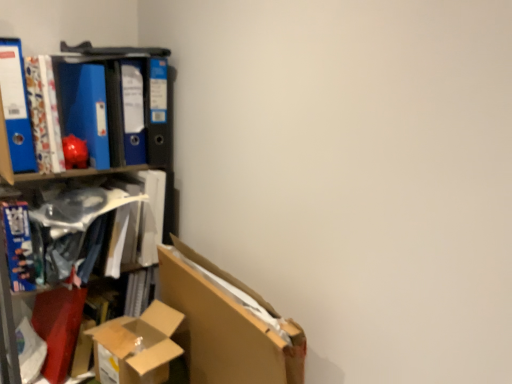
What is the approximate width of blue glossy book at left, acting as the second book starting from the right?

10.69 inches.

This screenshot has width=512, height=384. Find the location of `blue glossy book at left, acting as the second book starting from the right`. blue glossy book at left, acting as the second book starting from the right is located at coordinates (19, 246).

The image size is (512, 384). What do you see at coordinates (137, 346) in the screenshot?
I see `cardboard box at lower left` at bounding box center [137, 346].

This screenshot has width=512, height=384. What do you see at coordinates (95, 219) in the screenshot?
I see `matte plastic book at left, the first book when ordered from right to left` at bounding box center [95, 219].

Find the location of a particular element. The image size is (512, 384). blue glossy book at left, which ranks as the first book in left-to-right order is located at coordinates (19, 246).

Would you say blue matte folder at upper left, the 3th paperback book positioned from the left, is to the left or to the right of blue glossy book at left, acting as the second book starting from the right, in the picture?

Clearly, blue matte folder at upper left, the 3th paperback book positioned from the left, is on the right of blue glossy book at left, acting as the second book starting from the right, in the image.

From the picture: Is blue matte folder at upper left, the 3th paperback book positioned from the left, closer to camera compared to blue glossy book at left, which ranks as the first book in left-to-right order?

That is False.

Does point (140, 99) appear closer or farther from the camera than point (17, 291)?

Point (140, 99) is farther from the camera than point (17, 291).

How distant is blue matte folder at upper left, the 3th paperback book positioned from the left, from blue glossy book at left, which ranks as the first book in left-to-right order?

blue matte folder at upper left, the 3th paperback book positioned from the left, and blue glossy book at left, which ranks as the first book in left-to-right order, are 17.09 inches apart.

Who is shorter, blue matte folder at upper left, marked as the 2th paperback book in a left-to-right arrangement, or cardboard box at lower left?

cardboard box at lower left.

Consider the image. How far apart are blue matte folder at upper left, marked as the 2th paperback book in a left-to-right arrangement, and cardboard box at lower left?

blue matte folder at upper left, marked as the 2th paperback book in a left-to-right arrangement, is 24.28 inches from cardboard box at lower left.

Is blue matte folder at upper left, positioned as the second paperback book in right-to-left order, facing away from cardboard box at lower left?

blue matte folder at upper left, positioned as the second paperback book in right-to-left order, is not turned away from cardboard box at lower left.

Considering the points (56, 63) and (155, 311), which point is behind, point (56, 63) or point (155, 311)?

The point (155, 311) is behind.

From the picture: Who is smaller, blue glossy book at left, acting as the second book starting from the right, or cardboard box at lower left?

Smaller between the two is blue glossy book at left, acting as the second book starting from the right.

Is blue glossy book at left, which ranks as the first book in left-to-right order, taller or shorter than cardboard box at lower left?

Considering their sizes, blue glossy book at left, which ranks as the first book in left-to-right order, has more height than cardboard box at lower left.

How different are the orientations of blue glossy book at left, which ranks as the first book in left-to-right order, and cardboard box at lower left in degrees?

170 degrees separate the facing orientations of blue glossy book at left, which ranks as the first book in left-to-right order, and cardboard box at lower left.

From the image's perspective, relative to cardboard box at lower left, is blue glossy book at left, which ranks as the first book in left-to-right order, above or below?

blue glossy book at left, which ranks as the first book in left-to-right order, is above cardboard box at lower left.

Would you say cardboard box at lower left is a long distance from blue matte folder at upper left, the 3th paperback book positioned from the left?

That's not correct — cardboard box at lower left is a little close to blue matte folder at upper left, the 3th paperback book positioned from the left.

Considering the positions of objects cardboard box at lower left and blue matte folder at upper left, which is the first paperback book in right-to-left order, in the image provided, who is more to the left, cardboard box at lower left or blue matte folder at upper left, which is the first paperback book in right-to-left order,?

Positioned to the left is blue matte folder at upper left, which is the first paperback book in right-to-left order.

Is cardboard box at lower left facing away from blue matte folder at upper left, which is the first paperback book in right-to-left order?

No, cardboard box at lower left is not facing the opposite direction of blue matte folder at upper left, which is the first paperback book in right-to-left order.

From the picture: Is cardboard box at lower left not inside blue matte folder at upper left, the 3th paperback book positioned from the left?

cardboard box at lower left lies outside blue matte folder at upper left, the 3th paperback book positioned from the left,'s area.

Find the location of a particular element. This screenshot has width=512, height=384. box that is in front of the blue matte folder at upper left, marked as the 2th paperback book in a left-to-right arrangement is located at coordinates (137, 346).

From their relative heights in the image, would you say cardboard box at lower left is taller or shorter than blue matte folder at upper left, marked as the 2th paperback book in a left-to-right arrangement?

In the image, cardboard box at lower left appears to be shorter than blue matte folder at upper left, marked as the 2th paperback book in a left-to-right arrangement.

Does cardboard box at lower left contain blue matte folder at upper left, positioned as the second paperback book in right-to-left order?

No, blue matte folder at upper left, positioned as the second paperback book in right-to-left order, is not inside cardboard box at lower left.

Who is bigger, blue matte folder at left, which appears as the third paperback book when viewed from the right, or blue matte folder at upper left, the 3th paperback book positioned from the left?

Bigger between the two is blue matte folder at upper left, the 3th paperback book positioned from the left.

Is blue matte folder at left, arranged as the 1th paperback book when viewed from the left, at the right side of blue matte folder at upper left, the 3th paperback book positioned from the left?

No.

Based on the photo, which point is more forward, [7,46] or [135,142]?

The point [7,46] is in front.

Is blue matte folder at left, which appears as the third paperback book when viewed from the right, oriented away from blue matte folder at upper left, the 3th paperback book positioned from the left?

blue matte folder at left, which appears as the third paperback book when viewed from the right, is not turned away from blue matte folder at upper left, the 3th paperback book positioned from the left.

In terms of width, does blue glossy book at left, which ranks as the first book in left-to-right order, look wider or thinner when compared to blue matte folder at upper left, marked as the 2th paperback book in a left-to-right arrangement?

Clearly, blue glossy book at left, which ranks as the first book in left-to-right order, has more width compared to blue matte folder at upper left, marked as the 2th paperback book in a left-to-right arrangement.

From the image's perspective, is blue glossy book at left, which ranks as the first book in left-to-right order, below blue matte folder at upper left, positioned as the second paperback book in right-to-left order?

Correct, blue glossy book at left, which ranks as the first book in left-to-right order, appears lower than blue matte folder at upper left, positioned as the second paperback book in right-to-left order, in the image.

Is blue glossy book at left, which ranks as the first book in left-to-right order, not close to blue matte folder at upper left, marked as the 2th paperback book in a left-to-right arrangement?

blue glossy book at left, which ranks as the first book in left-to-right order, is actually quite close to blue matte folder at upper left, marked as the 2th paperback book in a left-to-right arrangement.

From a real-world perspective, relative to blue matte folder at upper left, marked as the 2th paperback book in a left-to-right arrangement, is blue glossy book at left, which ranks as the first book in left-to-right order, vertically above or below?

blue glossy book at left, which ranks as the first book in left-to-right order, is situated lower than blue matte folder at upper left, marked as the 2th paperback book in a left-to-right arrangement, in the real world.

Locate an element on the screen. the 3rd paperback book above when counting from the blue glossy book at left, which ranks as the first book in left-to-right order (from the image's perspective) is located at coordinates (133, 112).

Locate an element on the screen. Image resolution: width=512 pixels, height=384 pixels. box located below the blue matte folder at upper left, marked as the 2th paperback book in a left-to-right arrangement (from the image's perspective) is located at coordinates (137, 346).

Looking at the image, which one is located closer to blue matte folder at upper left, the 3th paperback book positioned from the left, cardboard box at lower left or blue glossy book at left, acting as the second book starting from the right?

The object closer to blue matte folder at upper left, the 3th paperback book positioned from the left, is blue glossy book at left, acting as the second book starting from the right.

Estimate the real-world distances between objects in this image. Which object is closer to cardboard box at lower left, blue matte folder at upper left, the 3th paperback book positioned from the left, or blue matte folder at upper left, positioned as the second paperback book in right-to-left order?

blue matte folder at upper left, the 3th paperback book positioned from the left.

When comparing their distances from blue glossy book at left, which ranks as the first book in left-to-right order, does blue matte folder at upper left, marked as the 2th paperback book in a left-to-right arrangement, or blue matte folder at left, which appears as the third paperback book when viewed from the right, seem further?

blue matte folder at upper left, marked as the 2th paperback book in a left-to-right arrangement, is further to blue glossy book at left, which ranks as the first book in left-to-right order.

Estimate the real-world distances between objects in this image. Which object is closer to matte plastic book at left, which is the 2th book from left to right, blue matte folder at upper left, which is the first paperback book in right-to-left order, or blue glossy book at left, which ranks as the first book in left-to-right order?

Among the two, blue glossy book at left, which ranks as the first book in left-to-right order, is located nearer to matte plastic book at left, which is the 2th book from left to right.

From the image, which object appears to be nearer to blue matte folder at left, which appears as the third paperback book when viewed from the right, cardboard box at lower left or blue glossy book at left, which ranks as the first book in left-to-right order?

Based on the image, blue glossy book at left, which ranks as the first book in left-to-right order, appears to be nearer to blue matte folder at left, which appears as the third paperback book when viewed from the right.

Based on their spatial positions, is blue glossy book at left, acting as the second book starting from the right, or blue matte folder at upper left, marked as the 2th paperback book in a left-to-right arrangement, closer to matte plastic book at left, which is the 2th book from left to right?

blue glossy book at left, acting as the second book starting from the right.

Which object lies further to the anchor point blue glossy book at left, which ranks as the first book in left-to-right order, blue matte folder at upper left, the 3th paperback book positioned from the left, or blue matte folder at left, arranged as the 1th paperback book when viewed from the left?

Among the two, blue matte folder at upper left, the 3th paperback book positioned from the left, is located further to blue glossy book at left, which ranks as the first book in left-to-right order.

Estimate the real-world distances between objects in this image. Which object is closer to cardboard box at lower left, blue matte folder at upper left, the 3th paperback book positioned from the left, or blue matte folder at left, which appears as the third paperback book when viewed from the right?

blue matte folder at upper left, the 3th paperback book positioned from the left, is positioned closer to the anchor cardboard box at lower left.

Identify the location of paperback book between blue matte folder at upper left, marked as the 2th paperback book in a left-to-right arrangement, and cardboard box at lower left from top to bottom. (16, 106).

Locate an element on the screen. This screenshot has width=512, height=384. book between blue matte folder at upper left, positioned as the second paperback book in right-to-left order, and blue glossy book at left, which ranks as the first book in left-to-right order, vertically is located at coordinates (95, 219).

Locate an element on the screen. The image size is (512, 384). paperback book between blue matte folder at upper left, positioned as the second paperback book in right-to-left order, and blue glossy book at left, acting as the second book starting from the right, from top to bottom is located at coordinates (16, 106).

At what (x,y) coordinates should I click in order to perform the action: click on paperback book between blue matte folder at left, which appears as the third paperback book when viewed from the right, and blue matte folder at upper left, which is the first paperback book in right-to-left order, from left to right. Please return your answer as a coordinate pair (x, y). Looking at the image, I should click on (84, 108).